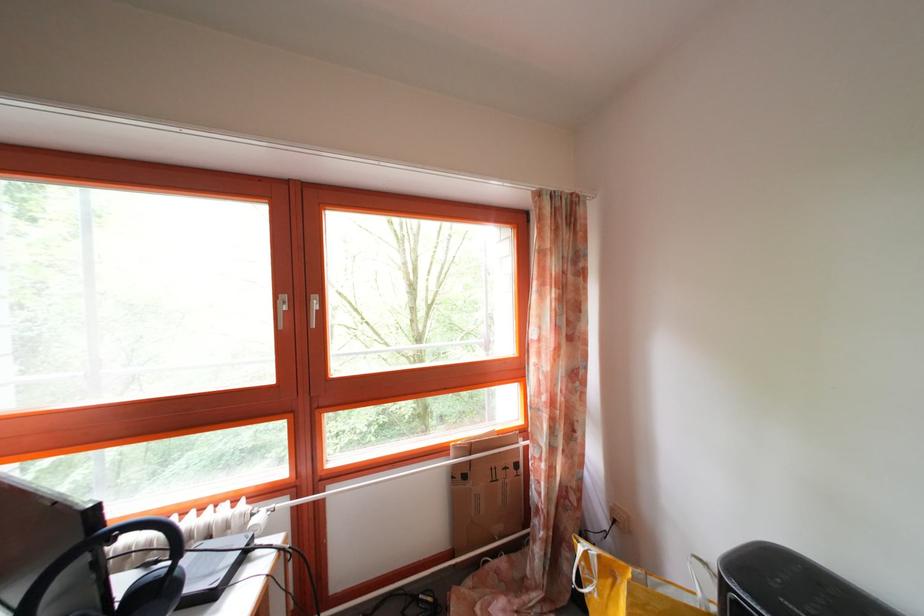
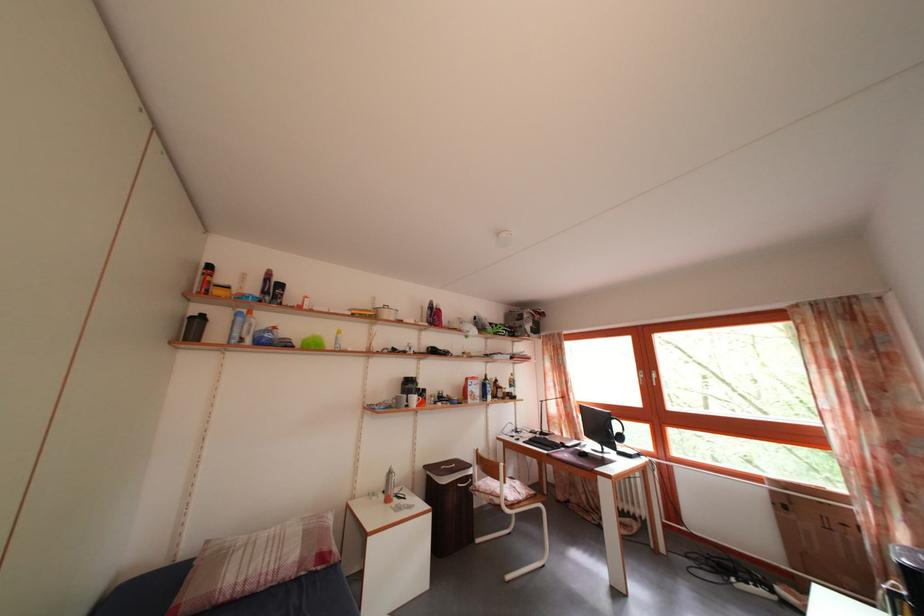
Find the pixel in the second image that matches the point at 299,310 in the first image.

(652, 382)